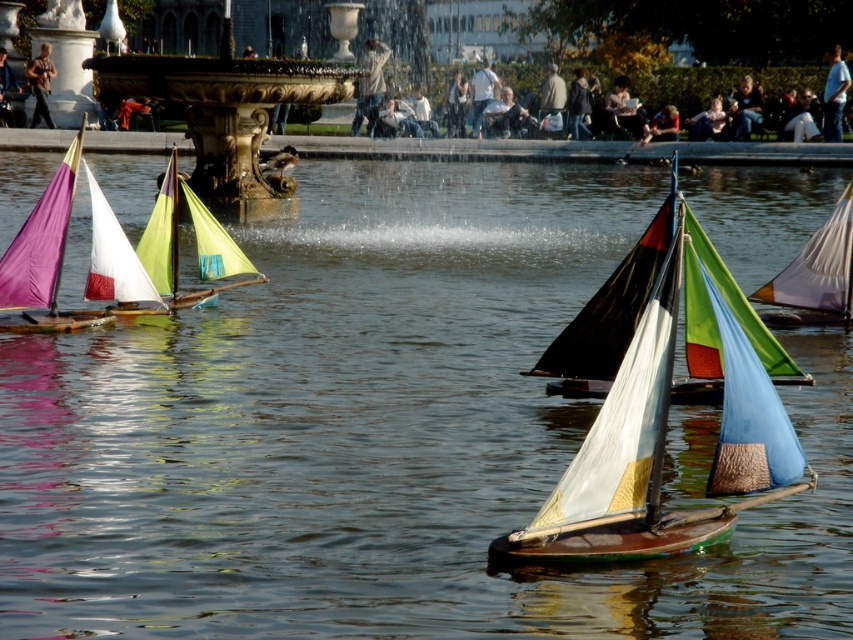
You are standing at the edge of the fountain and notice two sailboats, the matte black sailboat at center and the matte purple sailboat at left. Which boat would appear larger to someone looking directly at the fountain from your position?

The matte black sailboat at center appears larger because it is closer to the viewer than the matte purple sailboat at left.

In the scene shown: You are a visitor at the park and want to take a photo of the gold ornate fountain at upper center without any obstructions. However, there is a matte black sailboat at center in the way. Which object is taller, making it harder to capture the fountain clearly?

The matte black sailboat at center is much taller than the gold ornate fountain at upper center, so it would obstruct the view of the fountain.

You are standing at the fountain in the park and want to locate two points marked in the image. The first point is at coordinates point (637, 298) and the second is at point (59, 182). From your vantage point at the fountain, which point is closer to you?

Point (637, 298) is in front of point (59, 182), so the first point is closer to you.